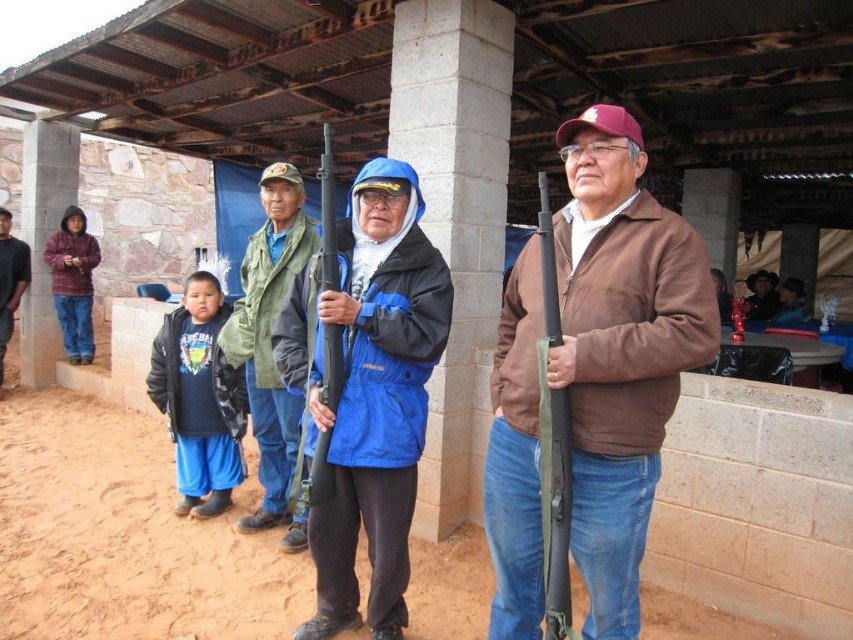
Is point (262, 404) in front of point (338, 368)?

No, (262, 404) is behind (338, 368).

This screenshot has height=640, width=853. Identify the location of green fabric jacket at center. (270, 344).

Between point (234, 404) and point (547, 579), which one is positioned behind?

Point (234, 404)

Does dark blue fleece jacket at center have a lesser height compared to matte black shotgun at right?

Indeed, dark blue fleece jacket at center has a lesser height compared to matte black shotgun at right.

At what (x,y) coordinates should I click in order to perform the action: click on dark blue fleece jacket at center. Please return your answer as a coordinate pair (x, y). Looking at the image, I should click on (199, 397).

Is point (517, 579) less distant than point (274, 164)?

Yes, it is in front of point (274, 164).

Is brown matte jacket at center smaller than green fabric jacket at center?

Yes.

Where is `brown matte jacket at center`? The image size is (853, 640). brown matte jacket at center is located at coordinates (619, 349).